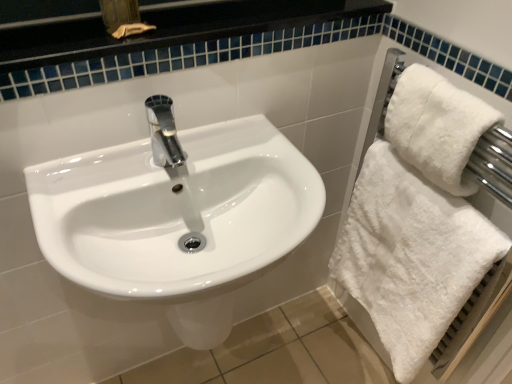
Question: Is white fluffy towel at right outside of white glossy sink at center?

Choices:
 (A) no
 (B) yes

Answer: (B)

Question: Does white fluffy towel at right lie behind white glossy sink at center?

Choices:
 (A) yes
 (B) no

Answer: (A)

Question: From a real-world perspective, is white fluffy towel at right physically below white glossy sink at center?

Choices:
 (A) no
 (B) yes

Answer: (A)

Question: Does white fluffy towel at right have a larger size compared to white glossy sink at center?

Choices:
 (A) no
 (B) yes

Answer: (A)

Question: Considering the relative sizes of white fluffy towel at right and white glossy sink at center in the image provided, is white fluffy towel at right taller than white glossy sink at center?

Choices:
 (A) no
 (B) yes

Answer: (A)

Question: Is white fluffy towel at right wider or thinner than white fluffy towel at right?

Choices:
 (A) thin
 (B) wide

Answer: (A)

Question: Visually, is white fluffy towel at right positioned to the left or to the right of white fluffy towel at right?

Choices:
 (A) left
 (B) right

Answer: (B)

Question: Based on their sizes in the image, would you say white fluffy towel at right is bigger or smaller than white fluffy towel at right?

Choices:
 (A) small
 (B) big

Answer: (A)

Question: Is white fluffy towel at right taller or shorter than white fluffy towel at right?

Choices:
 (A) short
 (B) tall

Answer: (A)

Question: In terms of size, does white glossy sink at center appear bigger or smaller than white fluffy towel at right?

Choices:
 (A) big
 (B) small

Answer: (A)

Question: Is white glossy sink at center spatially inside white fluffy towel at right, or outside of it?

Choices:
 (A) inside
 (B) outside

Answer: (B)

Question: From the image's perspective, is white glossy sink at center positioned above or below white fluffy towel at right?

Choices:
 (A) below
 (B) above

Answer: (B)

Question: From a real-world perspective, is white glossy sink at center above or below white fluffy towel at right?

Choices:
 (A) below
 (B) above

Answer: (B)

Question: In terms of size, does white fluffy towel at right appear bigger or smaller than white glossy sink at center?

Choices:
 (A) big
 (B) small

Answer: (B)

Question: In the image, is white fluffy towel at right positioned in front of or behind white glossy sink at center?

Choices:
 (A) front
 (B) behind

Answer: (B)